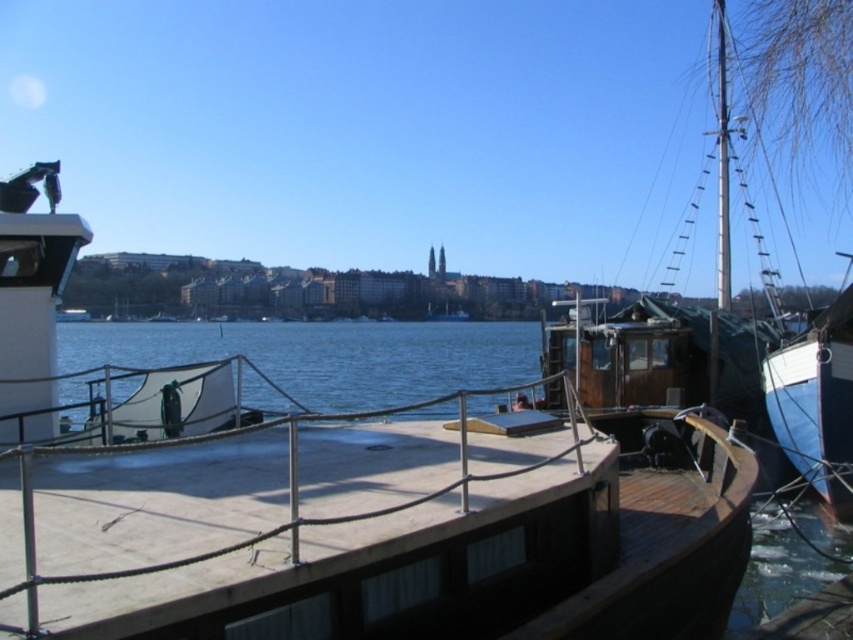
Question: Which is nearer to the smooth wooden deck at center?

Choices:
 (A) wooden boat at center
 (B) blue matte boat at right

Answer: (A)

Question: Can you confirm if wooden boat at center is positioned to the right of blue matte boat at right?

Choices:
 (A) yes
 (B) no

Answer: (B)

Question: Estimate the real-world distances between objects in this image. Which object is farther from the wooden boat at center?

Choices:
 (A) blue matte boat at right
 (B) smooth wooden deck at center

Answer: (A)

Question: Estimate the real-world distances between objects in this image. Which object is farther from the blue matte boat at right?

Choices:
 (A) wooden boat at center
 (B) smooth wooden deck at center

Answer: (A)

Question: Can you confirm if smooth wooden deck at center is positioned above blue matte boat at right?

Choices:
 (A) no
 (B) yes

Answer: (A)

Question: Is wooden boat at center below blue matte boat at right?

Choices:
 (A) no
 (B) yes

Answer: (A)